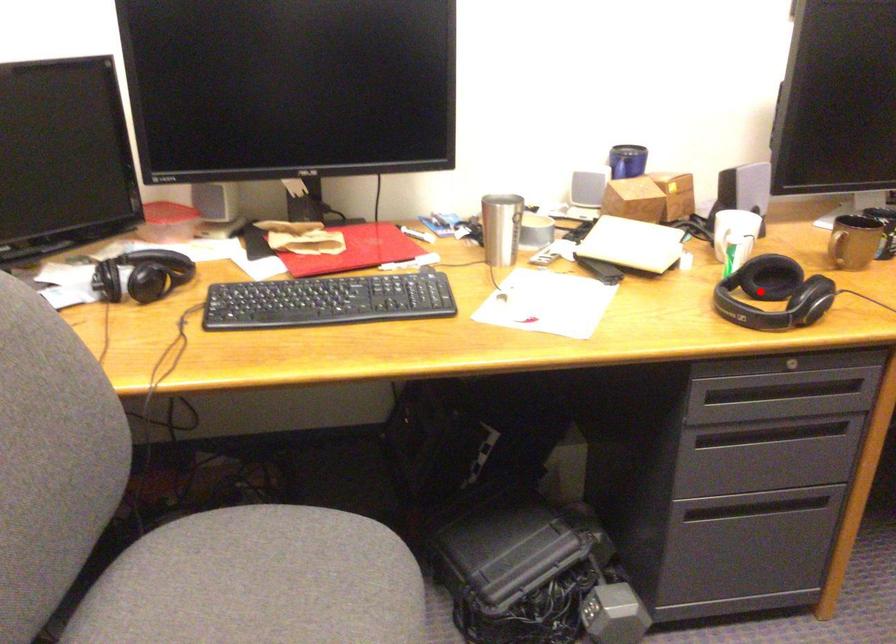
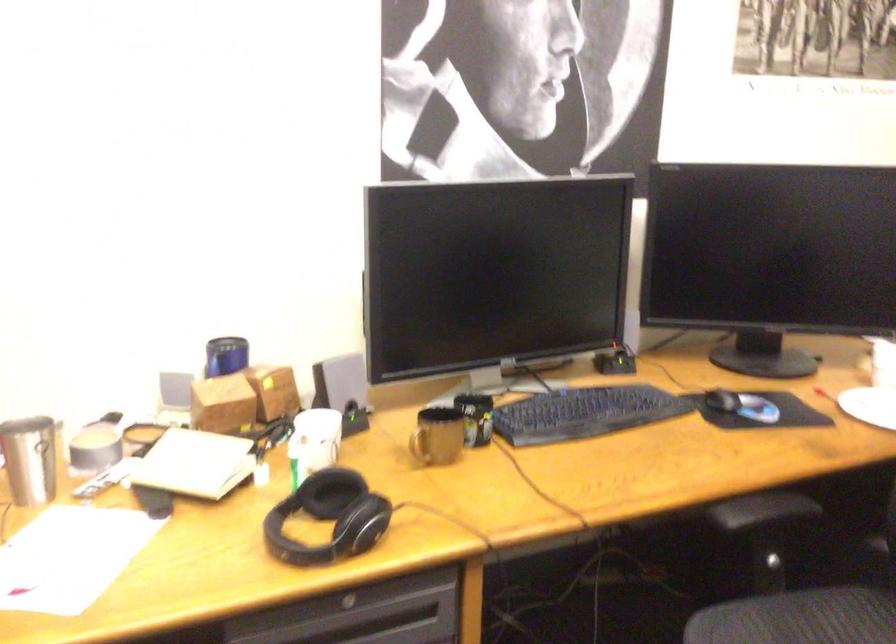
In the second image, find the point that corresponds to the highlighted location in the first image.

(329, 518)